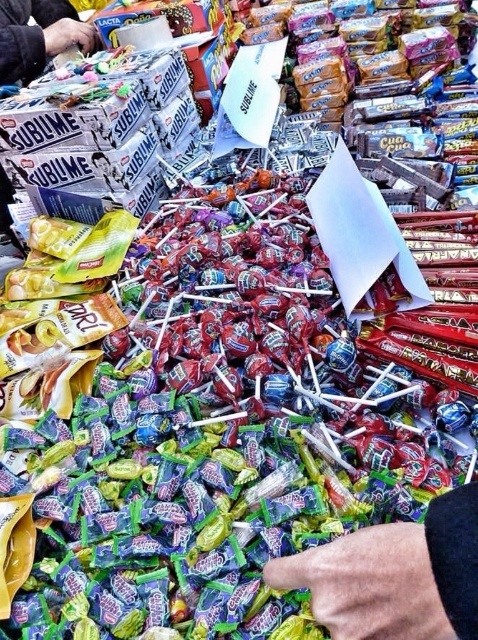
You are a person who wants to grab the smooth skin hand at center and the smooth plastic hand at upper left. Can you reach both at the same time while standing in front of them?

The smooth skin hand at center and the smooth plastic hand at upper left are 1.82 meters apart. Since the average human arm span is about 1.5 to 1.7 meters, it might be difficult to reach both at the same time.

Looking at this image, you are a candy buyer trying to grab a lollipop from the center pile. You see both the smooth skin hand at center and the smooth plastic hand at upper left. Which hand is more likely to be yours?

The smooth skin hand at center is more likely to be yours because it is smaller than the smooth plastic hand at upper left, and human hands are typically smaller in this context.

You are a customer at a candy stall. You see the smooth skin hand at center and the smooth plastic hand at upper left. Which hand is closer to the lollipops in the center?

The smooth skin hand at center is closer to the lollipops in the center because it is positioned on the right side of the smooth plastic hand at upper left, which is further away from the central lollipop pile.